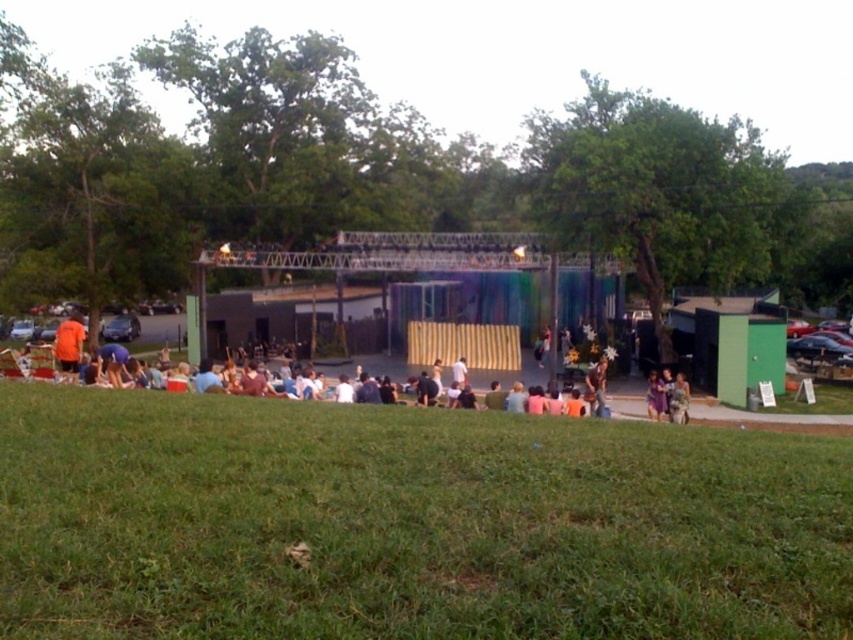
Question: Does green grassy field at lower center appear on the right side of wooden stage at center?

Choices:
 (A) yes
 (B) no

Answer: (A)

Question: Is green grassy field at lower center further to camera compared to wooden stage at center?

Choices:
 (A) yes
 (B) no

Answer: (B)

Question: Does wooden stage at center have a smaller size compared to green matte tent at lower right?

Choices:
 (A) yes
 (B) no

Answer: (B)

Question: Which of the following is the closest to the observer?

Choices:
 (A) wooden stage at center
 (B) orange fabric shirt at lower left
 (C) green matte tent at lower right

Answer: (B)

Question: Which object is closer to the camera taking this photo?

Choices:
 (A) green matte tent at lower right
 (B) green grassy field at lower center
 (C) light brown fabric dress at center
 (D) orange fabric shirt at lower left

Answer: (B)

Question: Which point is farther from the camera taking this photo?

Choices:
 (A) (71, 362)
 (B) (757, 374)

Answer: (B)